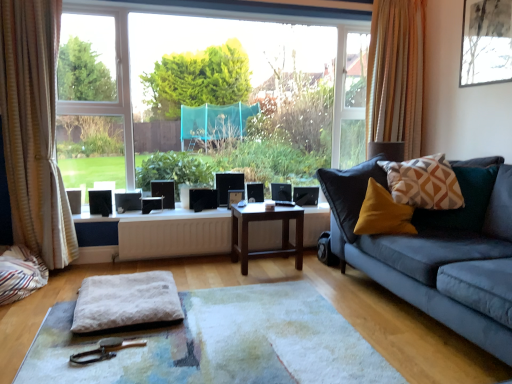
This screenshot has height=384, width=512. I want to click on vacant space underneath white soft cushion at center (from a real-world perspective), so click(x=254, y=322).